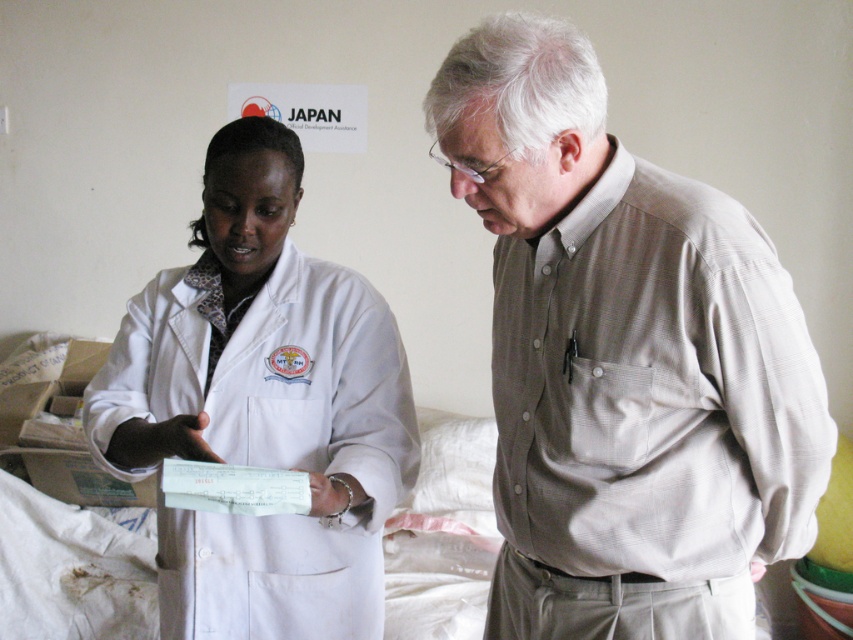
Is white smooth lab coat at center below white matte lab coat at center?

Incorrect, white smooth lab coat at center is not positioned below white matte lab coat at center.

Is point (616, 528) less distant than point (169, 301)?

Yes, it is.

Image resolution: width=853 pixels, height=640 pixels. Find the location of `white smooth lab coat at center`. white smooth lab coat at center is located at coordinates (624, 358).